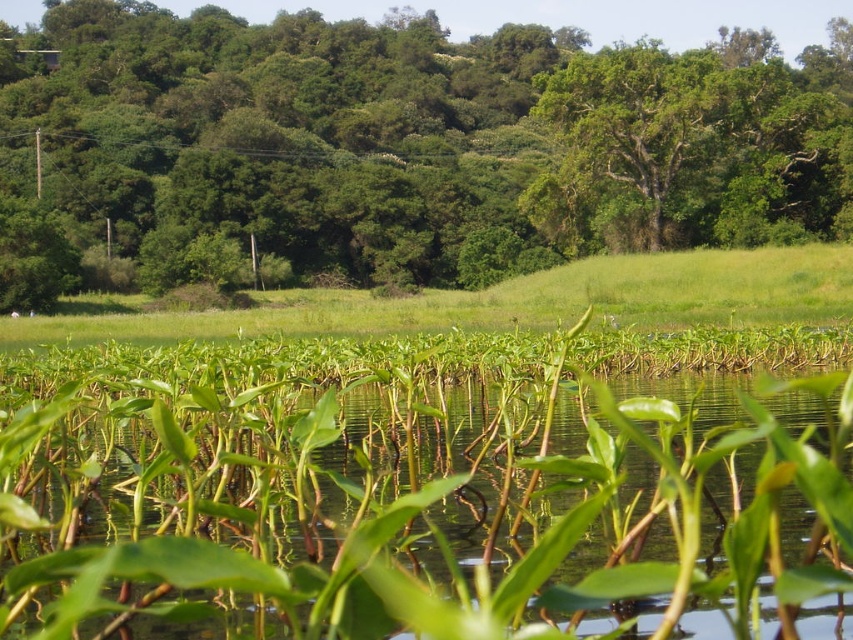
This screenshot has width=853, height=640. In order to click on green leafy tree at center in this screenshot , I will do `click(396, 148)`.

Can you confirm if green leafy tree at center is bigger than green grass at center?

Yes.

Who is more forward, (683, 243) or (589, 289)?

Positioned in front is point (589, 289).

Where is `green leafy tree at center`? This screenshot has width=853, height=640. green leafy tree at center is located at coordinates (396, 148).